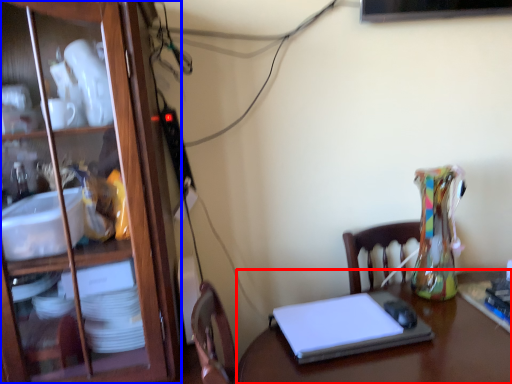
Question: Among these objects, which one is farthest to the camera, desk (highlighted by a red box) or cabinetry (highlighted by a blue box)?

Choices:
 (A) desk
 (B) cabinetry

Answer: (B)